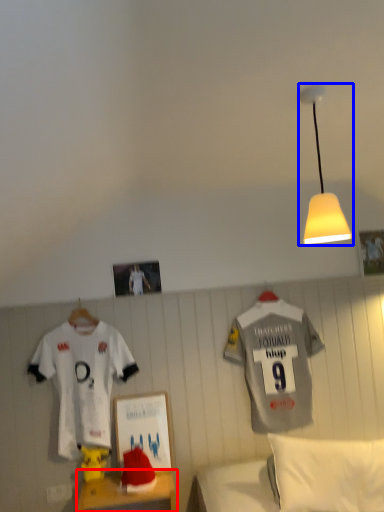
Question: Among these objects, which one is farthest to the camera, furniture (highlighted by a red box) or lamp (highlighted by a blue box)?

Choices:
 (A) furniture
 (B) lamp

Answer: (A)